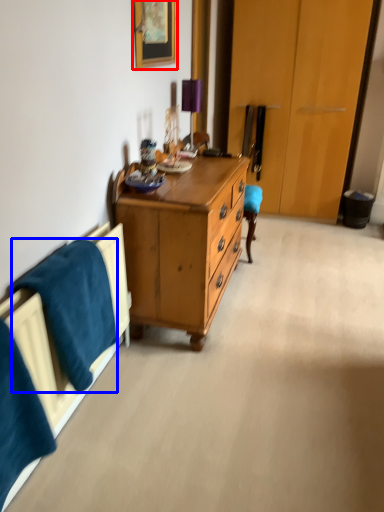
Question: Which of the following is the farthest to the observer, picture frame (highlighted by a red box) or blanket (highlighted by a blue box)?

Choices:
 (A) picture frame
 (B) blanket

Answer: (A)